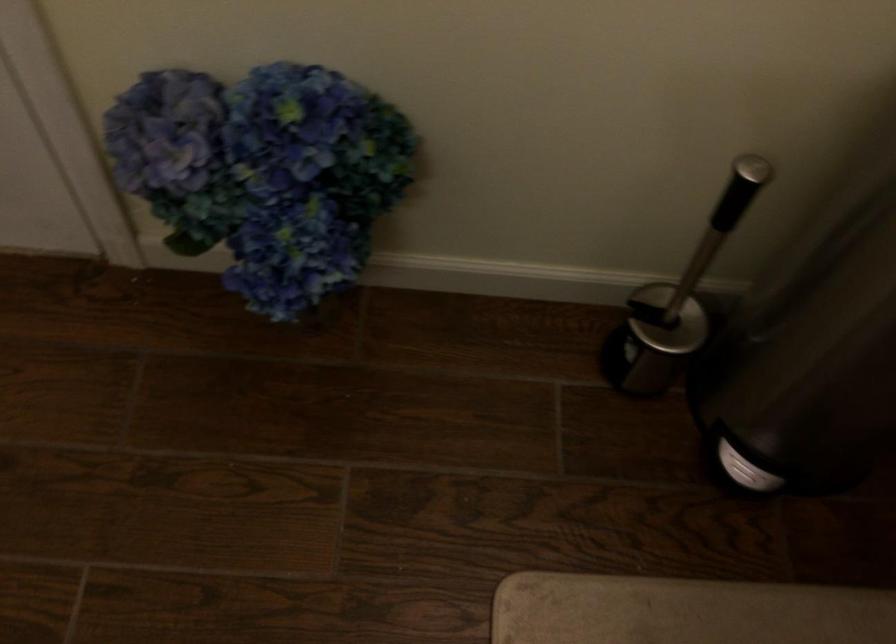
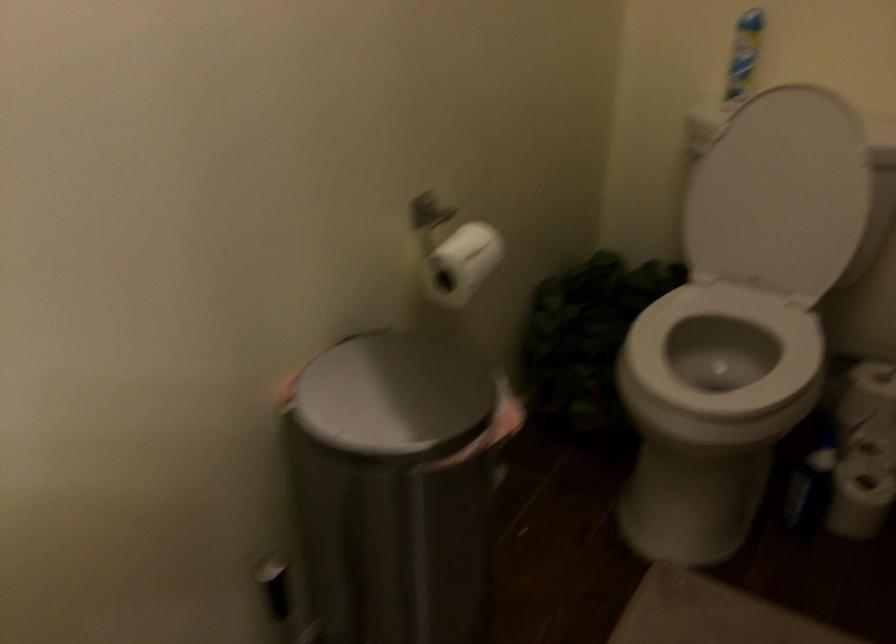
Question: How did the camera likely rotate?

Choices:
 (A) Left
 (B) Right
 (C) Up
 (D) Down

Answer: (B)